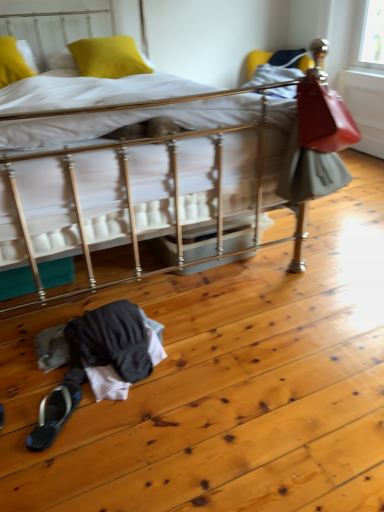
What do you see at coordinates (54, 414) in the screenshot?
I see `black fabric slipper at lower left` at bounding box center [54, 414].

What is the approximate width of metallic silver bed at center?

7.33 feet.

Find the location of a particular element. This screenshot has height=512, width=384. yellow matte pillow at upper left, which is the 1th pillow from right to left is located at coordinates (108, 57).

The image size is (384, 512). What are the coordinates of `black fabric slipper at lower left` in the screenshot? It's located at [54, 414].

Which of these two, black fabric slipper at lower left or yellow fabric pillow at upper left, the first pillow when ordered from left to right, is bigger?

yellow fabric pillow at upper left, the first pillow when ordered from left to right.

How many degrees apart are the facing directions of black fabric slipper at lower left and yellow fabric pillow at upper left, which ranks as the second pillow in right-to-left order?

black fabric slipper at lower left and yellow fabric pillow at upper left, which ranks as the second pillow in right-to-left order, are facing 153 degrees away from each other.

Does point (37, 442) come closer to viewer compared to point (1, 46)?

Yes, point (37, 442) is in front of point (1, 46).

Can you see black fabric slipper at lower left touching metallic silver bed at center?

black fabric slipper at lower left is not next to metallic silver bed at center, and they're not touching.

Considering the sizes of black fabric slipper at lower left and metallic silver bed at center in the image, is black fabric slipper at lower left wider or thinner than metallic silver bed at center?

Considering their sizes, black fabric slipper at lower left looks slimmer than metallic silver bed at center.

From a real-world perspective, which object stands above the other?

metallic silver bed at center is physically above.

Between point (55, 403) and point (165, 50), which one is positioned in front?

The point (55, 403) is closer to the camera.

Considering the relative sizes of metallic silver bed at center and yellow matte pillow at upper left, the second pillow positioned from the left, in the image provided, is metallic silver bed at center wider than yellow matte pillow at upper left, the second pillow positioned from the left,?

Yes.

From the image's perspective, which one is positioned lower, metallic silver bed at center or yellow matte pillow at upper left, the second pillow positioned from the left?

metallic silver bed at center.

Is metallic silver bed at center facing away from yellow matte pillow at upper left, which is the 1th pillow from right to left?

Absolutely, metallic silver bed at center is directed away from yellow matte pillow at upper left, which is the 1th pillow from right to left.

Who is shorter, metallic silver bed at center or yellow matte pillow at upper left, the second pillow positioned from the left?

With less height is yellow matte pillow at upper left, the second pillow positioned from the left.

Considering the relative sizes of yellow fabric pillow at upper left, which ranks as the second pillow in right-to-left order, and metallic silver bed at center in the image provided, is yellow fabric pillow at upper left, which ranks as the second pillow in right-to-left order, taller than metallic silver bed at center?

Incorrect, the height of yellow fabric pillow at upper left, which ranks as the second pillow in right-to-left order, is not larger of that of metallic silver bed at center.

From the picture: Is yellow fabric pillow at upper left, which ranks as the second pillow in right-to-left order, positioned far away from metallic silver bed at center?

Yes.

From the picture: From the image's perspective, is yellow fabric pillow at upper left, the first pillow when ordered from left to right, located beneath metallic silver bed at center?

No, from the image's perspective, yellow fabric pillow at upper left, the first pillow when ordered from left to right, is not below metallic silver bed at center.

Considering the sizes of objects yellow fabric pillow at upper left, the first pillow when ordered from left to right, and metallic silver bed at center in the image provided, who is wider, yellow fabric pillow at upper left, the first pillow when ordered from left to right, or metallic silver bed at center?

Wider between the two is metallic silver bed at center.

Considering the sizes of objects black fabric slipper at lower left and yellow matte pillow at upper left, which is the 1th pillow from right to left, in the image provided, who is thinner, black fabric slipper at lower left or yellow matte pillow at upper left, which is the 1th pillow from right to left,?

black fabric slipper at lower left is thinner.

Which is in front, black fabric slipper at lower left or yellow matte pillow at upper left, the second pillow positioned from the left?

black fabric slipper at lower left.

Would you consider black fabric slipper at lower left to be distant from yellow matte pillow at upper left, the second pillow positioned from the left?

Yes, black fabric slipper at lower left and yellow matte pillow at upper left, the second pillow positioned from the left, are quite far apart.

Do you think black fabric slipper at lower left is within yellow matte pillow at upper left, the second pillow positioned from the left, or outside of it?

The correct answer is: outside.

Is the surface of yellow matte pillow at upper left, the second pillow positioned from the left, in direct contact with black fabric slipper at lower left?

They are not placed beside each other.

Considering the relative sizes of yellow matte pillow at upper left, the second pillow positioned from the left, and black fabric slipper at lower left in the image provided, is yellow matte pillow at upper left, the second pillow positioned from the left, bigger than black fabric slipper at lower left?

Correct, yellow matte pillow at upper left, the second pillow positioned from the left, is larger in size than black fabric slipper at lower left.

Can you confirm if yellow matte pillow at upper left, the second pillow positioned from the left, is wider than black fabric slipper at lower left?

Indeed, yellow matte pillow at upper left, the second pillow positioned from the left, has a greater width compared to black fabric slipper at lower left.

Looking at this image, is yellow matte pillow at upper left, which is the 1th pillow from right to left, not within black fabric slipper at lower left?

Yes.

Which of these two, metallic silver bed at center or yellow fabric pillow at upper left, which ranks as the second pillow in right-to-left order, is wider?

Wider between the two is metallic silver bed at center.

From the image's perspective, is metallic silver bed at center above yellow fabric pillow at upper left, the first pillow when ordered from left to right?

No.

Is metallic silver bed at center next to yellow fabric pillow at upper left, which ranks as the second pillow in right-to-left order, and touching it?

No.

Is metallic silver bed at center oriented away from yellow fabric pillow at upper left, the first pillow when ordered from left to right?

Yes.

This screenshot has height=512, width=384. Identify the location of footwear located underneath the yellow fabric pillow at upper left, the first pillow when ordered from left to right (from a real-world perspective). 54,414.

Where is `footwear behind the metallic silver bed at center`? The width and height of the screenshot is (384, 512). footwear behind the metallic silver bed at center is located at coordinates (54, 414).

Which object lies nearer to the anchor point yellow fabric pillow at upper left, the first pillow when ordered from left to right, metallic silver bed at center or yellow matte pillow at upper left, which is the 1th pillow from right to left?

The object closer to yellow fabric pillow at upper left, the first pillow when ordered from left to right, is yellow matte pillow at upper left, which is the 1th pillow from right to left.

When comparing their distances from metallic silver bed at center, does yellow fabric pillow at upper left, the first pillow when ordered from left to right, or black fabric slipper at lower left seem closer?

Among the two, yellow fabric pillow at upper left, the first pillow when ordered from left to right, is located nearer to metallic silver bed at center.

Based on their spatial positions, is metallic silver bed at center or yellow fabric pillow at upper left, which ranks as the second pillow in right-to-left order, closer to yellow matte pillow at upper left, which is the 1th pillow from right to left?

yellow fabric pillow at upper left, which ranks as the second pillow in right-to-left order.

From the picture: Estimate the real-world distances between objects in this image. Which object is closer to yellow matte pillow at upper left, the second pillow positioned from the left, yellow fabric pillow at upper left, which ranks as the second pillow in right-to-left order, or black fabric slipper at lower left?

Based on the image, yellow fabric pillow at upper left, which ranks as the second pillow in right-to-left order, appears to be nearer to yellow matte pillow at upper left, the second pillow positioned from the left.

When comparing their distances from black fabric slipper at lower left, does metallic silver bed at center or yellow matte pillow at upper left, which is the 1th pillow from right to left, seem further?

metallic silver bed at center is further to black fabric slipper at lower left.

From the image, which object appears to be nearer to metallic silver bed at center, yellow fabric pillow at upper left, which ranks as the second pillow in right-to-left order, or yellow matte pillow at upper left, which is the 1th pillow from right to left?

Based on the image, yellow matte pillow at upper left, which is the 1th pillow from right to left, appears to be nearer to metallic silver bed at center.

When comparing their distances from yellow fabric pillow at upper left, the first pillow when ordered from left to right, does black fabric slipper at lower left or yellow matte pillow at upper left, the second pillow positioned from the left, seem further?

The object further to yellow fabric pillow at upper left, the first pillow when ordered from left to right, is black fabric slipper at lower left.

Considering their positions, is yellow fabric pillow at upper left, the first pillow when ordered from left to right, positioned further to black fabric slipper at lower left than metallic silver bed at center?

metallic silver bed at center lies further to black fabric slipper at lower left than the other object.

You are a GUI agent. You are given a task and a screenshot of the screen. Output one action in this format:
    pyautogui.click(x=<x>, y=<y>)
    Task: Click on the pillow between metallic silver bed at center and yellow fabric pillow at upper left, which ranks as the second pillow in right-to-left order, from front to back
    The height and width of the screenshot is (512, 384).
    Given the screenshot: What is the action you would take?
    pyautogui.click(x=108, y=57)

In order to click on bed between yellow fabric pillow at upper left, which ranks as the second pillow in right-to-left order, and black fabric slipper at lower left, in the vertical direction in this screenshot , I will do `click(175, 30)`.

Where is `bed between yellow matte pillow at upper left, the second pillow positioned from the left, and black fabric slipper at lower left, in the vertical direction`? bed between yellow matte pillow at upper left, the second pillow positioned from the left, and black fabric slipper at lower left, in the vertical direction is located at coordinates (175, 30).

Image resolution: width=384 pixels, height=512 pixels. What are the coordinates of `pillow between yellow fabric pillow at upper left, which ranks as the second pillow in right-to-left order, and black fabric slipper at lower left from top to bottom` in the screenshot? It's located at (108, 57).